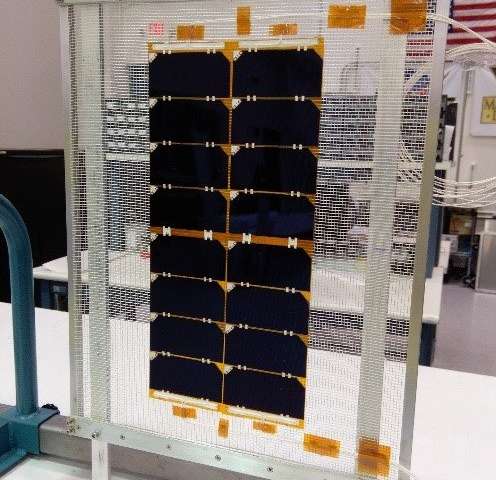
What are the coordinates of `floor` in the screenshot? It's located at (467, 318).